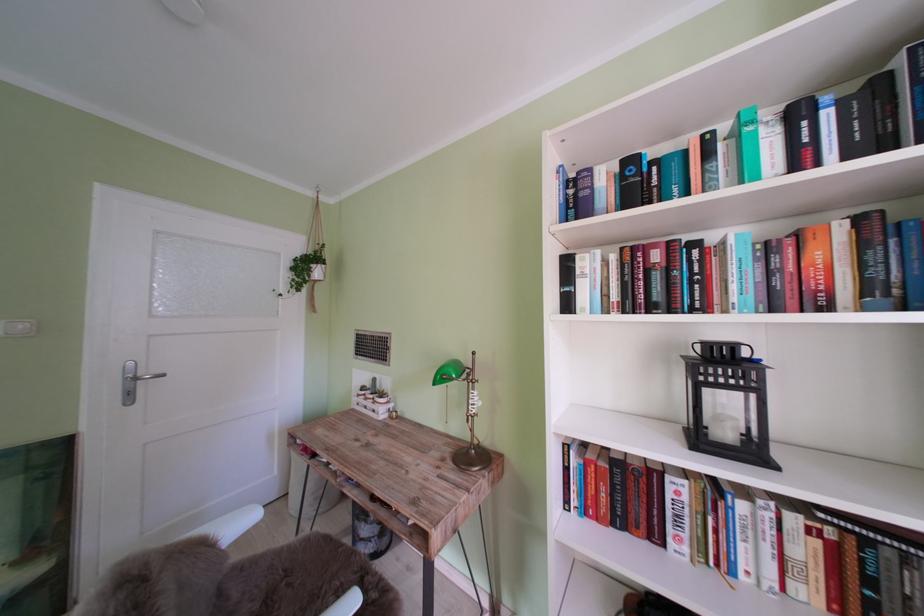
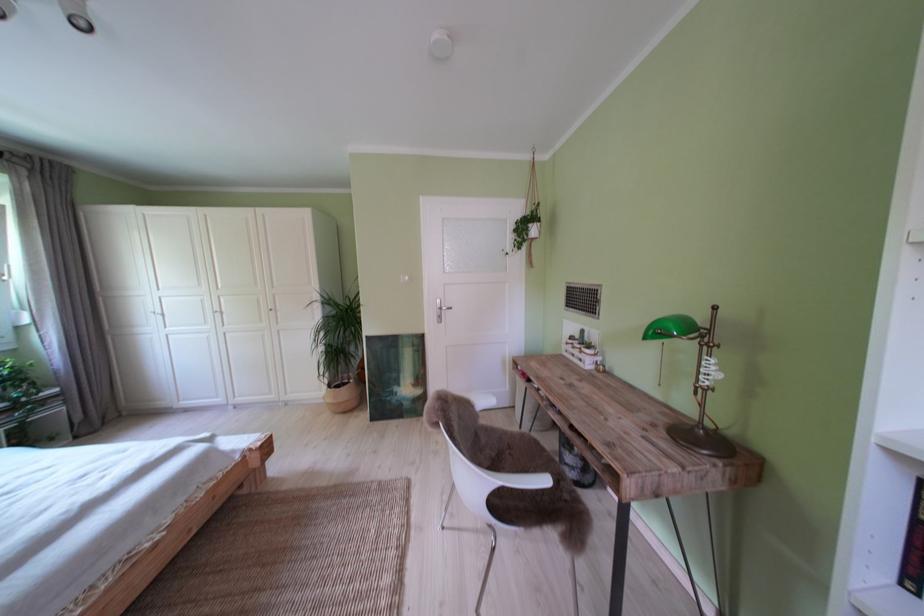
The point at (295, 281) is marked in the first image. Where is the corresponding point in the second image?

(520, 244)